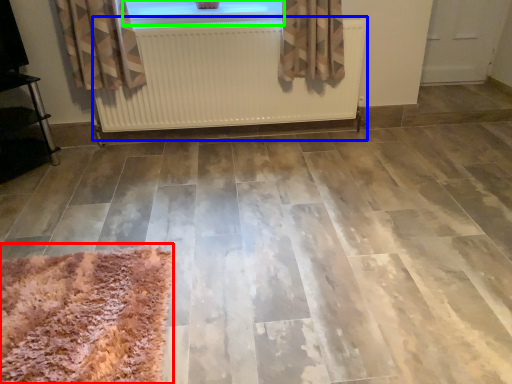
Question: Based on their relative distances, which object is farther from mat (highlighted by a red box)? Choose from radiator (highlighted by a blue box) and window (highlighted by a green box).

Choices:
 (A) radiator
 (B) window

Answer: (B)